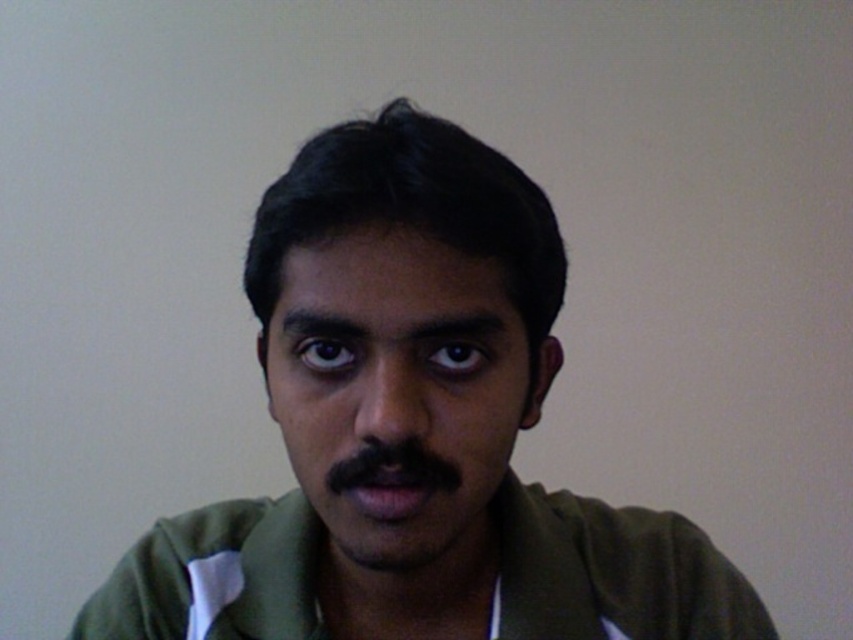
Does green matte shirt at center appear on the right side of matte green face at center?

Correct, you'll find green matte shirt at center to the right of matte green face at center.

Between green matte shirt at center and matte green face at center, which one appears on the left side from the viewer's perspective?

Positioned to the left is matte green face at center.

The height and width of the screenshot is (640, 853). Find the location of `green matte shirt at center`. green matte shirt at center is located at coordinates (413, 429).